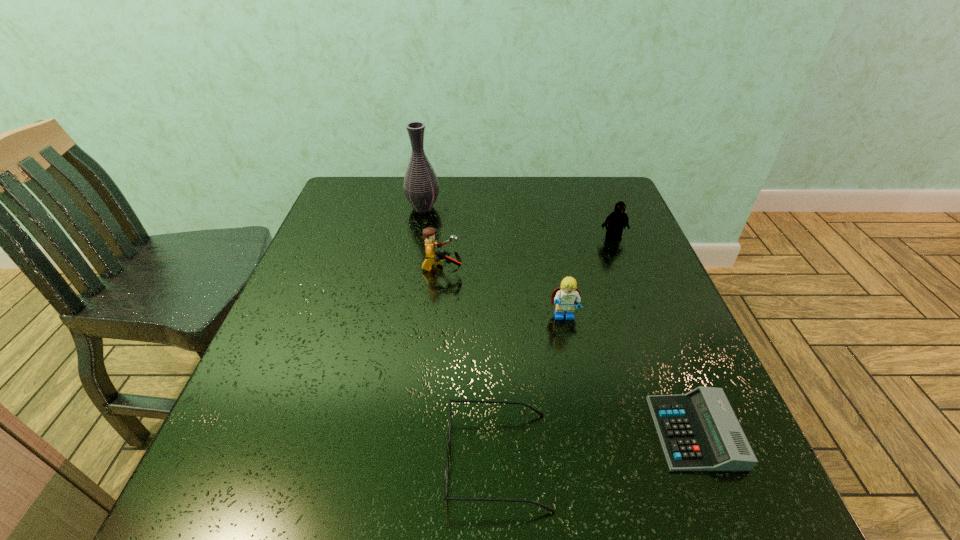
Locate an element on the screen. Image resolution: width=960 pixels, height=540 pixels. vase is located at coordinates (421, 187).

I want to click on the tallest object, so click(x=421, y=187).

You are a GUI agent. You are given a task and a screenshot of the screen. Output one action in this format:
    pyautogui.click(x=<x>, y=<y>)
    Task: Click on the leftmost Lego
    
    Given the screenshot: What is the action you would take?
    pyautogui.click(x=432, y=257)

This screenshot has width=960, height=540. What are the coordinates of `the second nearest Lego` in the screenshot? It's located at (432, 257).

Locate an element on the screen. This screenshot has width=960, height=540. the fifth nearest object is located at coordinates (617, 220).

You are a GUI agent. You are given a task and a screenshot of the screen. Output one action in this format:
    pyautogui.click(x=<x>, y=<y>)
    Task: Click on the rightmost Lego
    
    Given the screenshot: What is the action you would take?
    pyautogui.click(x=617, y=220)

You are a GUI agent. You are given a task and a screenshot of the screen. Output one action in this format:
    pyautogui.click(x=<x>, y=<y>)
    Task: Click on the third object from right to left
    The height and width of the screenshot is (540, 960).
    Given the screenshot: What is the action you would take?
    pyautogui.click(x=566, y=297)

Find the location of `the third nearest object`. the third nearest object is located at coordinates pos(566,297).

In order to click on the fifth tallest object in this screenshot , I will do `click(446, 480)`.

The image size is (960, 540). I want to click on calculator, so click(x=699, y=431).